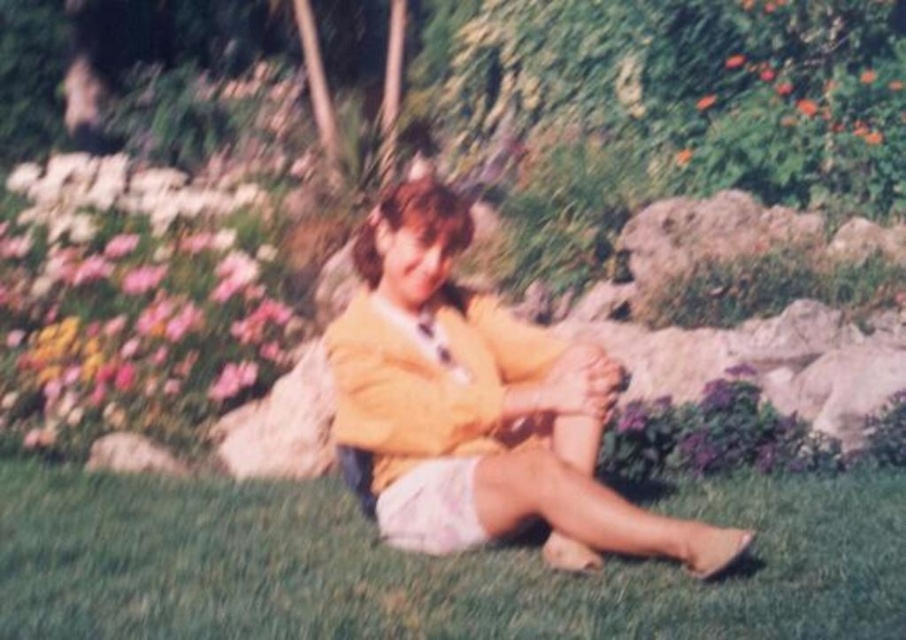
Is green grass at lower center taller than pink satin skirt at lower center?

No.

Is green grass at lower center smaller than pink satin skirt at lower center?

Actually, green grass at lower center might be larger than pink satin skirt at lower center.

Who is more forward, (254, 513) or (411, 490)?

Point (411, 490) is more forward.

Find the location of `green grass at lower center`. green grass at lower center is located at coordinates (425, 564).

Between point (550, 515) and point (442, 464), which one is positioned in front?

Point (550, 515)

Measure the distance between point (735, 532) and camera.

Point (735, 532) and camera are 3.63 meters apart from each other.

You are a GUI agent. You are given a task and a screenshot of the screen. Output one action in this format:
    pyautogui.click(x=<x>, y=<y>)
    Task: Click on the yellow matte jacket at center
    This screenshot has width=906, height=640.
    Given the screenshot: What is the action you would take?
    pyautogui.click(x=478, y=406)

Can you confirm if green grass at lower center is shorter than pink matte flower at left?

Correct, green grass at lower center is not as tall as pink matte flower at left.

Which is above, green grass at lower center or pink matte flower at left?

pink matte flower at left

Does point (750, 486) come in front of point (239, 360)?

Yes, point (750, 486) is in front of point (239, 360).

Locate an element on the screen. The height and width of the screenshot is (640, 906). green grass at lower center is located at coordinates click(425, 564).